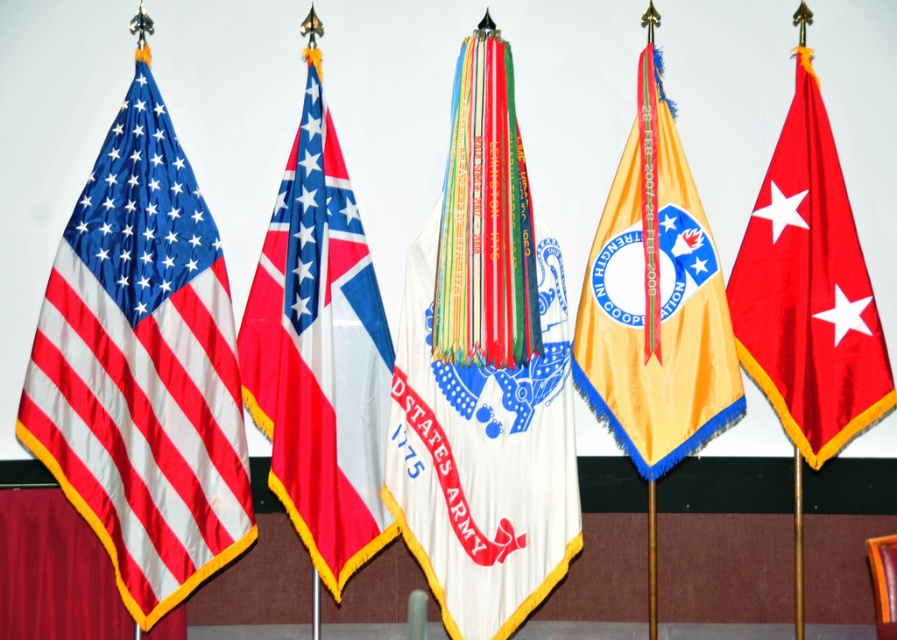
Question: Is red and white fabric flag at center positioned behind orange fabric chair at lower right?

Choices:
 (A) yes
 (B) no

Answer: (A)

Question: Among these objects, which one is farthest from the camera?

Choices:
 (A) orange fabric chair at lower right
 (B) yellow silk flag at center

Answer: (B)

Question: Can you confirm if white fabric flag at center is positioned below red and white fabric flag at center?

Choices:
 (A) yes
 (B) no

Answer: (A)

Question: Does matte fabric flag at left lie behind orange fabric chair at lower right?

Choices:
 (A) yes
 (B) no

Answer: (A)

Question: Which of the following is the closest to the observer?

Choices:
 (A) shiny red flag at right
 (B) matte fabric flag at left
 (C) orange fabric chair at lower right
 (D) yellow silk flag at center

Answer: (C)

Question: Which of these objects is positioned closest to the yellow silk flag at center?

Choices:
 (A) white fabric flag at center
 (B) orange fabric chair at lower right

Answer: (A)